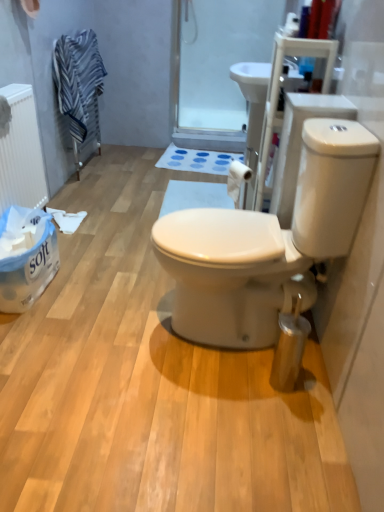
Question: Is white matte toilet paper at center bigger or smaller than blue fabric bath mat at center?

Choices:
 (A) big
 (B) small

Answer: (B)

Question: Is white matte toilet paper at center spatially inside blue fabric bath mat at center, or outside of it?

Choices:
 (A) inside
 (B) outside

Answer: (B)

Question: Estimate the real-world distances between objects in this image. Which object is farther from the striped fabric towel at upper left?

Choices:
 (A) white paper towel at lower left
 (B) white matte radiator at left
 (C) transparent plastic screen door at upper center
 (D) blue fabric bath mat at center
 (E) white matte toilet paper at center

Answer: (E)

Question: Based on their relative distances, which object is farther from the blue fabric bath mat at center?

Choices:
 (A) striped fabric towel at upper left
 (B) white matte radiator at left
 (C) white matte toilet paper at center
 (D) transparent plastic screen door at upper center
 (E) white glossy toilet at center

Answer: (E)